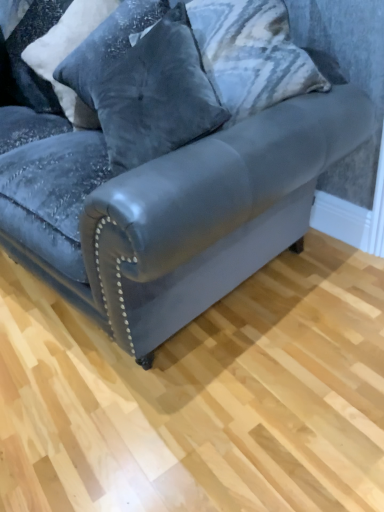
Question: Is velvet pillow at upper left, which appears as the 2th pillow when viewed from the right, wider than velvet gray pillow at upper center, which appears as the 4th pillow when viewed from the left?

Choices:
 (A) no
 (B) yes

Answer: (A)

Question: From the image's perspective, is velvet pillow at upper left, which appears as the 2th pillow when viewed from the right, above velvet gray pillow at upper center, placed as the 1th pillow when sorted from right to left?

Choices:
 (A) no
 (B) yes

Answer: (B)

Question: From a real-world perspective, is velvet pillow at upper left, positioned as the third pillow in left-to-right order, under velvet gray pillow at upper center, placed as the 1th pillow when sorted from right to left?

Choices:
 (A) yes
 (B) no

Answer: (B)

Question: Does velvet pillow at upper left, which appears as the 2th pillow when viewed from the right, lie behind velvet gray pillow at upper center, placed as the 1th pillow when sorted from right to left?

Choices:
 (A) no
 (B) yes

Answer: (B)

Question: Considering the relative sizes of velvet pillow at upper left, positioned as the third pillow in left-to-right order, and velvet gray pillow at upper center, which appears as the 4th pillow when viewed from the left, in the image provided, is velvet pillow at upper left, positioned as the third pillow in left-to-right order, bigger than velvet gray pillow at upper center, which appears as the 4th pillow when viewed from the left,?

Choices:
 (A) no
 (B) yes

Answer: (A)

Question: From a real-world perspective, is velvet gray pillow at upper center, which appears as the 4th pillow when viewed from the left, above or below velvet dark blue pillow at upper left, placed as the 1th pillow when sorted from left to right?

Choices:
 (A) below
 (B) above

Answer: (A)

Question: In terms of size, does velvet gray pillow at upper center, which appears as the 4th pillow when viewed from the left, appear bigger or smaller than velvet dark blue pillow at upper left, the 4th pillow when ordered from right to left?

Choices:
 (A) small
 (B) big

Answer: (B)

Question: Considering their positions, is velvet gray pillow at upper center, which appears as the 4th pillow when viewed from the left, located in front of or behind velvet dark blue pillow at upper left, placed as the 1th pillow when sorted from left to right?

Choices:
 (A) front
 (B) behind

Answer: (A)

Question: Is velvet gray pillow at upper center, which appears as the 4th pillow when viewed from the left, taller or shorter than velvet dark blue pillow at upper left, placed as the 1th pillow when sorted from left to right?

Choices:
 (A) short
 (B) tall

Answer: (B)

Question: From the image's perspective, is velvet pillow at upper left, positioned as the third pillow in left-to-right order, above or below velvet dark gray pillow at upper left, which ranks as the 2th pillow in left-to-right order?

Choices:
 (A) above
 (B) below

Answer: (B)

Question: Considering their positions, is velvet pillow at upper left, positioned as the third pillow in left-to-right order, located in front of or behind velvet dark gray pillow at upper left, which is the third pillow in right-to-left order?

Choices:
 (A) front
 (B) behind

Answer: (A)

Question: Based on their sizes in the image, would you say velvet pillow at upper left, which appears as the 2th pillow when viewed from the right, is bigger or smaller than velvet dark gray pillow at upper left, which is the third pillow in right-to-left order?

Choices:
 (A) big
 (B) small

Answer: (A)

Question: Considering the positions of velvet pillow at upper left, positioned as the third pillow in left-to-right order, and velvet dark gray pillow at upper left, which ranks as the 2th pillow in left-to-right order, in the image, is velvet pillow at upper left, positioned as the third pillow in left-to-right order, taller or shorter than velvet dark gray pillow at upper left, which ranks as the 2th pillow in left-to-right order,?

Choices:
 (A) short
 (B) tall

Answer: (B)

Question: From a real-world perspective, is velvet pillow at upper left, which appears as the 2th pillow when viewed from the right, positioned above or below velvet dark blue couch at center?

Choices:
 (A) below
 (B) above

Answer: (B)

Question: In the image, is velvet pillow at upper left, positioned as the third pillow in left-to-right order, on the left side or the right side of velvet dark blue couch at center?

Choices:
 (A) right
 (B) left

Answer: (A)